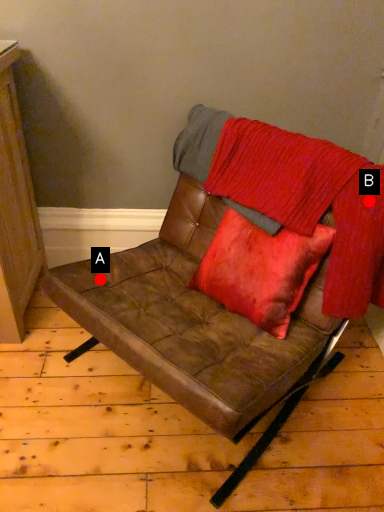
Question: Two points are circled on the image, labeled by A and B beside each circle. Among these points, which one is farthest from the camera?

Choices:
 (A) A is further
 (B) B is further

Answer: (A)